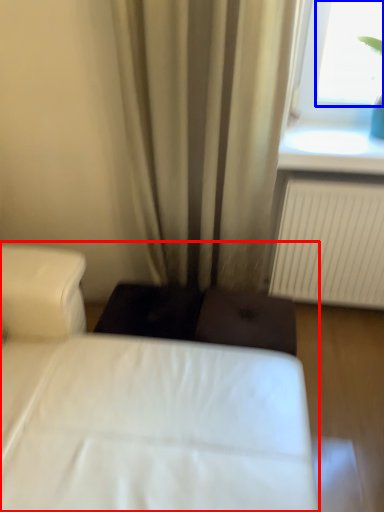
Question: Which object is further to the camera taking this photo, bed (highlighted by a red box) or window screen (highlighted by a blue box)?

Choices:
 (A) bed
 (B) window screen

Answer: (B)